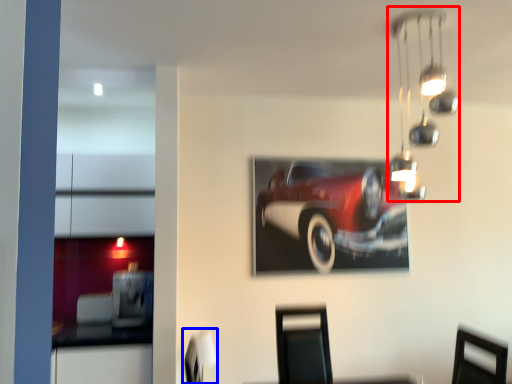
Question: Which object appears farthest to the camera in this image, lamp (highlighted by a red box) or swivel chair (highlighted by a blue box)?

Choices:
 (A) lamp
 (B) swivel chair

Answer: (B)